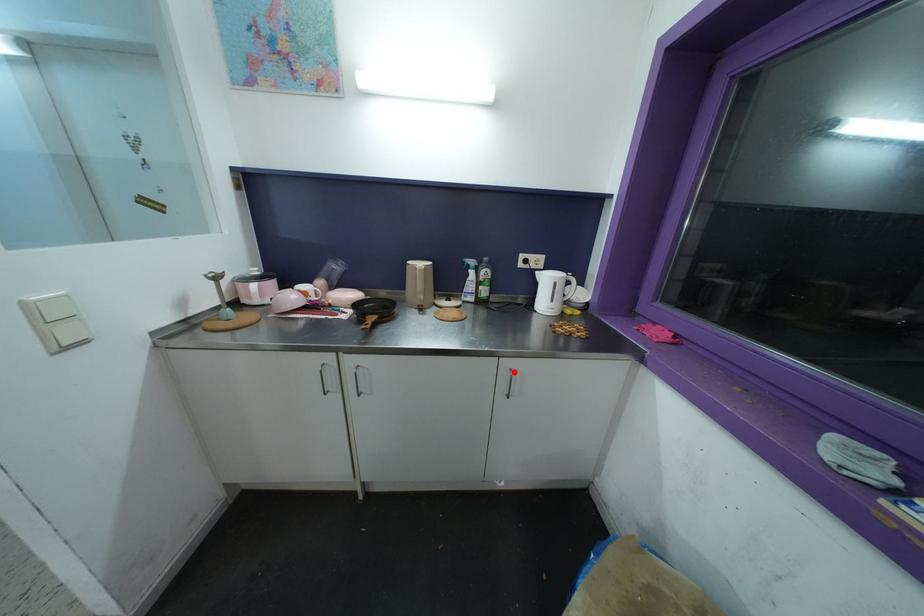
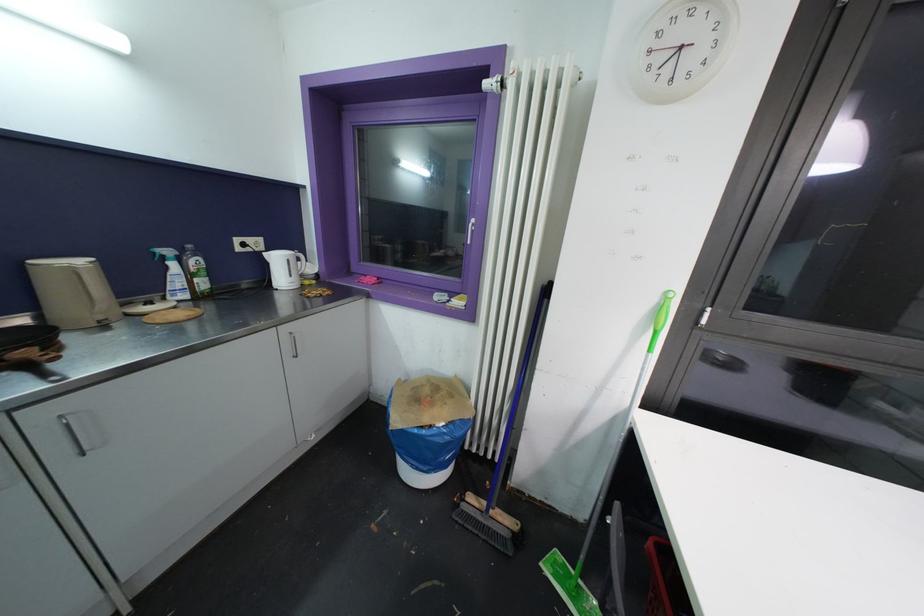
Locate, in the second image, the point that corresponds to the highlighted location in the first image.

(294, 336)